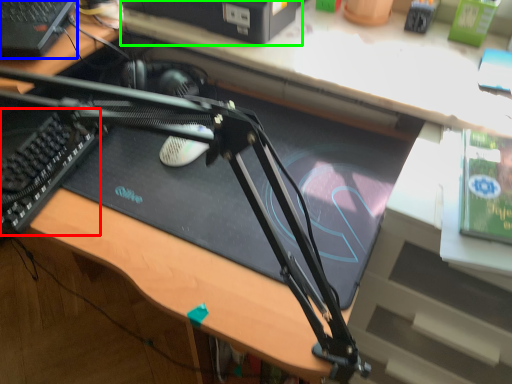
Question: Estimate the real-world distances between objects in this image. Which object is closer to laptop keyboard (highlighted by a red box), computer (highlighted by a blue box) or computer (highlighted by a green box)?

Choices:
 (A) computer
 (B) computer

Answer: (A)